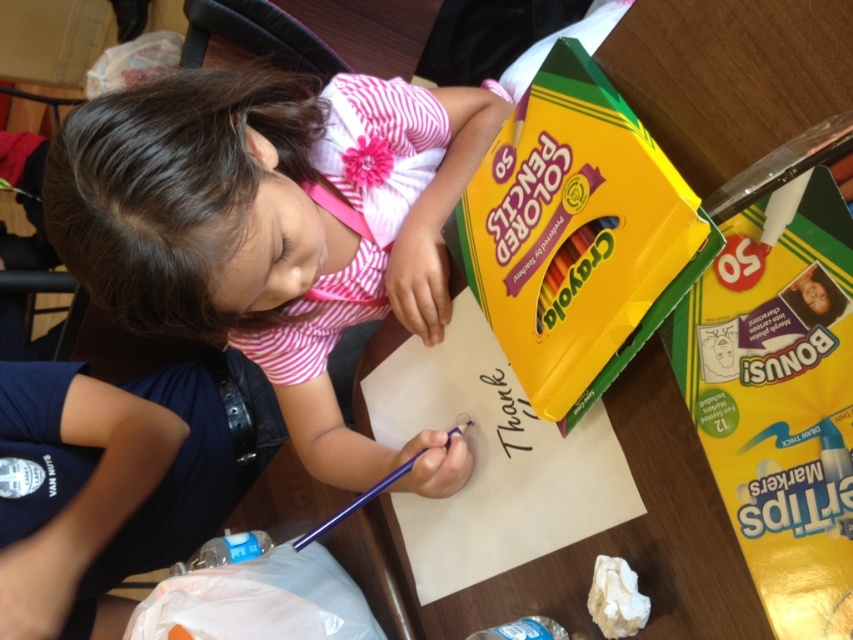
Question: Does smooth pink shirt at center appear on the right side of white crumpled paper at lower center?

Choices:
 (A) no
 (B) yes

Answer: (A)

Question: Which point appears farthest from the camera in this image?

Choices:
 (A) (757, 289)
 (B) (614, 566)
 (C) (338, 323)
 (D) (547, 77)

Answer: (C)

Question: Which point is farther from the camera taking this photo?

Choices:
 (A) (766, 532)
 (B) (334, 237)
 (C) (572, 356)
 (D) (618, 573)

Answer: (B)

Question: Among these objects, which one is farthest from the camera?

Choices:
 (A) smooth pink shirt at center
 (B) yellow glossy markers at right
 (C) matte yellow crayola colored pencils at upper right

Answer: (A)

Question: Can you confirm if yellow glossy markers at right is wider than matte yellow crayola colored pencils at upper right?

Choices:
 (A) yes
 (B) no

Answer: (B)

Question: Is matte yellow crayola colored pencils at upper right further to the viewer compared to white crumpled paper at lower center?

Choices:
 (A) yes
 (B) no

Answer: (B)